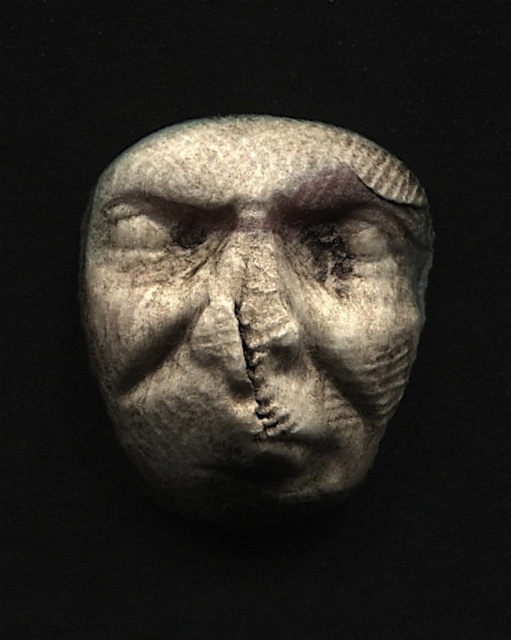
Question: Can you confirm if gray stone face at center is bigger than gray stone forehead at center?

Choices:
 (A) yes
 (B) no

Answer: (A)

Question: Does gray stone face at center have a greater width compared to gray stone forehead at center?

Choices:
 (A) yes
 (B) no

Answer: (A)

Question: Does gray stone face at center have a smaller size compared to gray stone forehead at center?

Choices:
 (A) yes
 (B) no

Answer: (B)